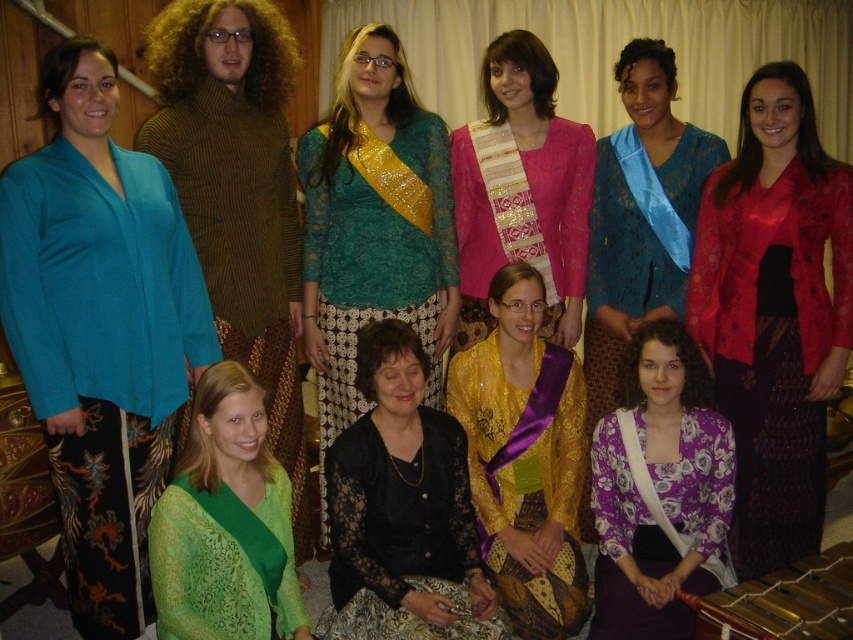
You are a photographer setting up for a family photo. You notice the satin red blouse at upper right and the gold sequined blouse at center. Which blouse is closer to the camera?

The satin red blouse at upper right is closer to the camera because it is positioned over the gold sequined blouse at center.

From the picture: You are a photographer setting up for a family photo. You notice the teal silk blouse at left and the black lace dress at center. Which clothing item is positioned higher in the image?

The teal silk blouse at left is above the black lace dress at center, so it is positioned higher in the image.

You are standing at the entrance of the room and want to reach the point marked as point (18, 364). However, there is an obstacle at point (561, 625). Can you reach your destination without passing through the obstacle?

Yes, because point (18, 364) is in front of point (561, 625), so you can reach it without going through the obstacle.